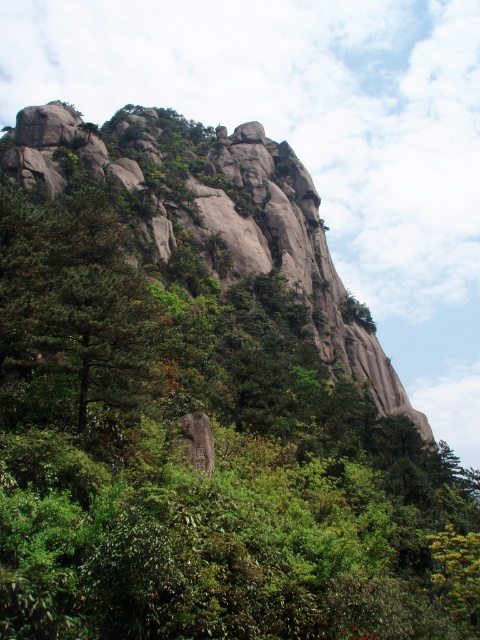
Question: Which point appears farthest from the camera in this image?

Choices:
 (A) (128, 125)
 (B) (63, 291)
 (C) (177, 428)

Answer: (A)

Question: Is gray rock at upper center to the left of green matte tree at left from the viewer's perspective?

Choices:
 (A) yes
 (B) no

Answer: (B)

Question: Which object is closer to the camera taking this photo?

Choices:
 (A) green matte tree at left
 (B) gray rock at upper center
 (C) rough gray rock at center

Answer: (A)

Question: In this image, where is gray rock at upper center located relative to rough gray rock at center?

Choices:
 (A) above
 (B) below

Answer: (A)

Question: Which of these objects is positioned farthest from the gray rock at upper center?

Choices:
 (A) green matte tree at left
 (B) rough gray rock at center

Answer: (B)

Question: Does green matte tree at left have a larger size compared to rough gray rock at center?

Choices:
 (A) no
 (B) yes

Answer: (B)